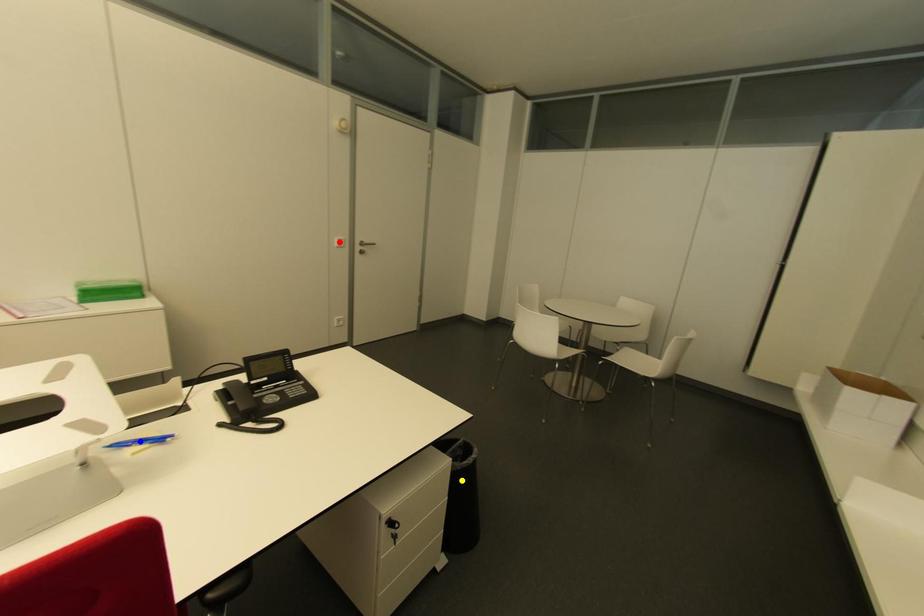
Order these from nearest to farthest:
blue point | yellow point | red point

red point → yellow point → blue point